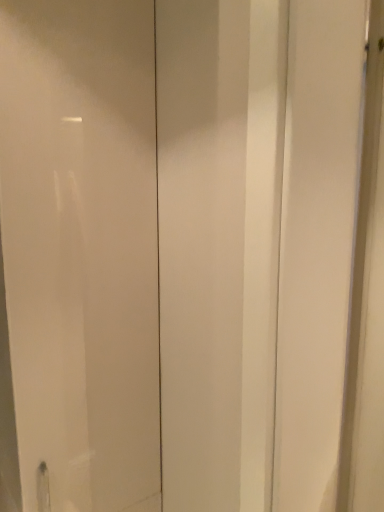
Where is `white glossy screen door at left`? This screenshot has height=512, width=384. white glossy screen door at left is located at coordinates (78, 257).

What do you see at coordinates (78, 257) in the screenshot? Image resolution: width=384 pixels, height=512 pixels. I see `white glossy screen door at left` at bounding box center [78, 257].

This screenshot has height=512, width=384. In order to click on white glossy screen door at left in this screenshot , I will do `click(78, 257)`.